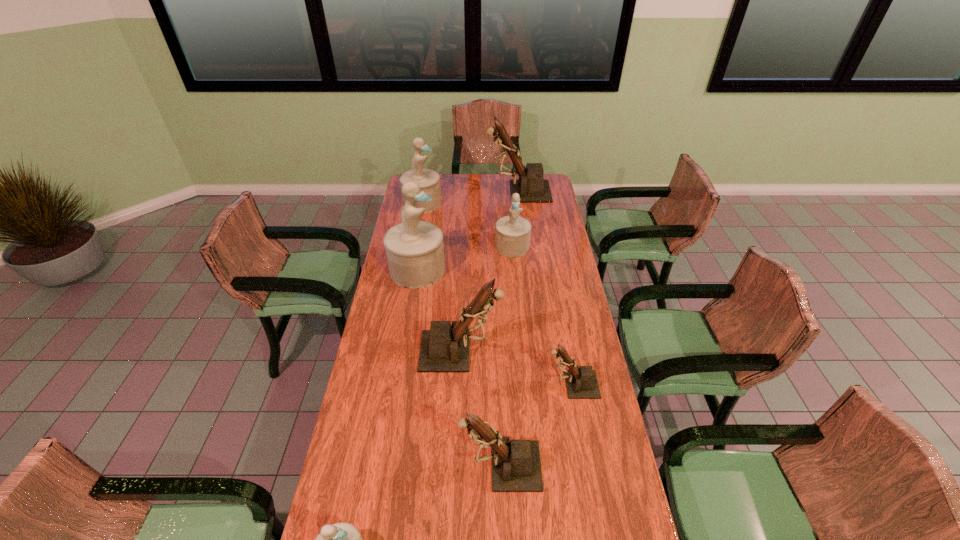
Where is `free space located on the front-facing side of the biggest brown figurine`? free space located on the front-facing side of the biggest brown figurine is located at coordinates (420, 192).

The image size is (960, 540). I want to click on free region located at the beak of the biggest white figurine, so click(x=517, y=269).

What are the coordinates of `free space located 0.110m at the beak of the farthest white figurine` in the screenshot? It's located at (462, 202).

Locate an element on the screen. vacant space situated 0.220m on the front-facing side of the third smallest brown figurine is located at coordinates (559, 351).

The height and width of the screenshot is (540, 960). What are the coordinates of `vacant point located at the beak of the second smallest white figurine` in the screenshot? It's located at (515, 276).

Locate an element on the screen. The width and height of the screenshot is (960, 540). vacant position located on the front-facing side of the second smallest brown figurine is located at coordinates [x=343, y=465].

You are a GUI agent. You are given a task and a screenshot of the screen. Output one action in this format:
    pyautogui.click(x=<x>, y=<y>)
    Task: Click on the vacant region located 0.300m on the front-facing side of the second smallest brown figurine
    The height and width of the screenshot is (540, 960).
    Given the screenshot: What is the action you would take?
    pyautogui.click(x=362, y=465)

Find the location of a particular element. vacant space situated on the front-facing side of the second smallest brown figurine is located at coordinates (352, 465).

I want to click on vacant space located on the front-facing side of the smallest brown figurine, so click(x=498, y=384).

Locate an element on the screen. vacant space located 0.230m on the front-facing side of the smallest brown figurine is located at coordinates (481, 384).